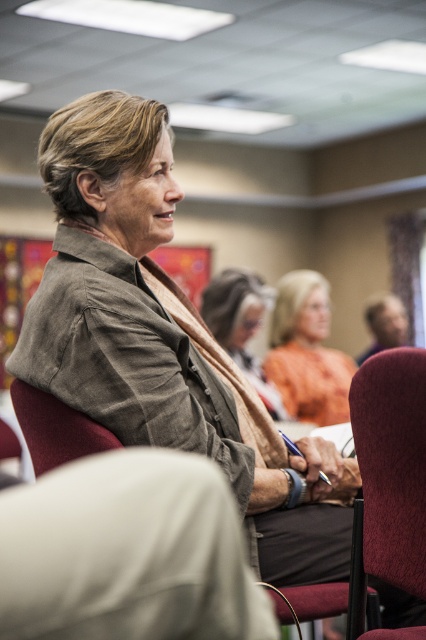
In the conference room scene, there are two central items of clothing worn by attendees. The first is an orange matte shirt at center, and the second is a light brown textured sweater at center. Which of these two items is positioned to the right of the other?

The orange matte shirt at center is to the right of the light brown textured sweater at center.